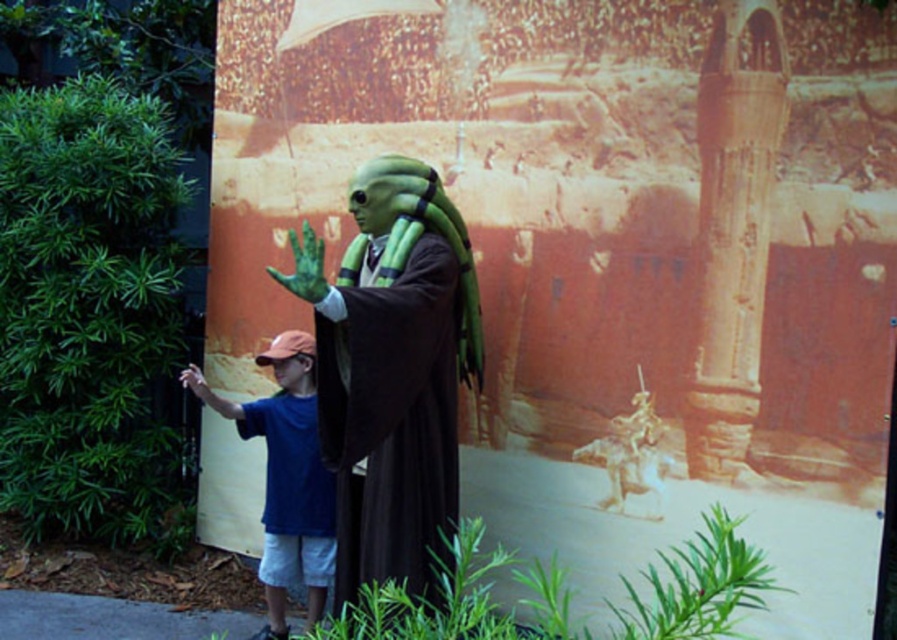
Which is in front, point (376, 400) or point (196, 372)?

Positioned in front is point (376, 400).

Locate an element on the screen. The image size is (897, 640). green matte alien at center is located at coordinates (392, 371).

Is green matte alien at center to the right of green matte hand at center from the viewer's perspective?

Indeed, green matte alien at center is positioned on the right side of green matte hand at center.

Where is `green matte alien at center`? This screenshot has height=640, width=897. green matte alien at center is located at coordinates (392, 371).

Between green matte hand at center and green matte hand at lower left, which one has more height?

Standing taller between the two is green matte hand at center.

Does green matte hand at center have a greater height compared to green matte hand at lower left?

Yes, green matte hand at center is taller than green matte hand at lower left.

Between point (276, 276) and point (197, 381), which one is positioned in front?

Point (276, 276) is in front.

Locate an element on the screen. green matte hand at center is located at coordinates (303, 266).